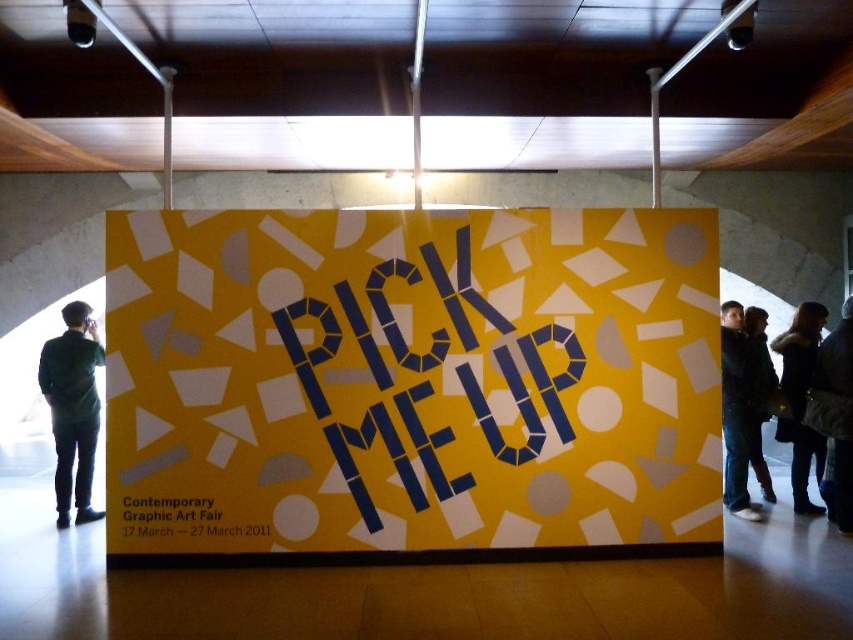
Does yellow paper poster at center have a lesser width compared to dark green shirt at left?

No, yellow paper poster at center is not thinner than dark green shirt at left.

Is yellow paper poster at center behind dark green shirt at left?

No, yellow paper poster at center is closer to the viewer.

Between point (695, 440) and point (55, 476), which one is positioned behind?

Point (55, 476)

You are a GUI agent. You are given a task and a screenshot of the screen. Output one action in this format:
    pyautogui.click(x=<x>, y=<y>)
    Task: Click on the yellow paper poster at center
    
    Given the screenshot: What is the action you would take?
    pyautogui.click(x=416, y=376)

Does dark green shirt at left appear over dark blue leather jacket at right?

No.

Consider the image. Which is below, dark green shirt at left or dark blue leather jacket at right?

Positioned lower is dark green shirt at left.

Does point (47, 346) come behind point (793, 358)?

No, (47, 346) is in front of (793, 358).

Locate an element on the screen. This screenshot has height=640, width=853. dark green shirt at left is located at coordinates (73, 406).

Which is in front, point (369, 316) or point (199, 515)?

Point (199, 515) is more forward.

Consider the image. Does yellow paper poster at center have a smaller size compared to black paper at lower left?

Actually, yellow paper poster at center might be larger than black paper at lower left.

Image resolution: width=853 pixels, height=640 pixels. In order to click on yellow paper poster at center in this screenshot , I will do `click(416, 376)`.